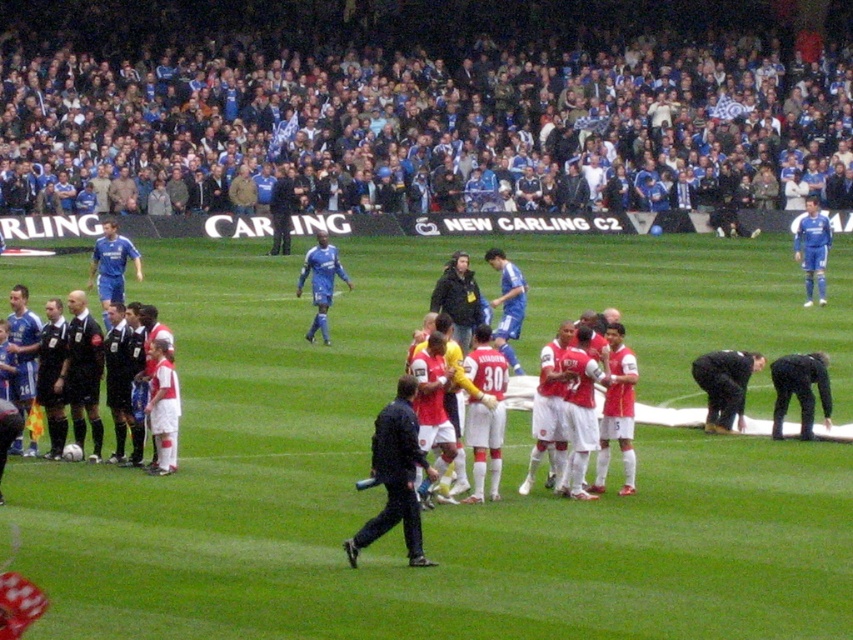
You are a photographer standing at the center of the field. You want to take a photo of the blue smooth soccer player at upper right. Which direction should you move to get the player into the frame?

The blue smooth soccer player at upper right is located at coordinates 0.388 on the x axis and 0.953 on the y axis. Since the photographer is at the center, moving towards the upper right direction would position the player within the frame.

You are a photographer at the edge of the field. You need to capture a photo of both the blue smooth soccer player at upper right and the blue jersey at center in the same frame. Based on their positions, which one should you focus on first to ensure both are in the shot?

The blue smooth soccer player at upper right is located above the blue jersey at center. To capture both in the same frame, focus on the blue smooth soccer player at upper right first as it is positioned higher up, allowing the blue jersey at center to be included below it in the shot.

You are a photographer standing on the sidelines of the football match. You want to take a photo that includes both the white jersey at left and the blue smooth soccer player at upper right. Based on their positions, which one should you adjust your camera to focus on first to ensure both are in the frame?

The white jersey at left is in front of the blue smooth soccer player at upper right, so you should focus on the white jersey at left first to ensure both are visible in the frame.